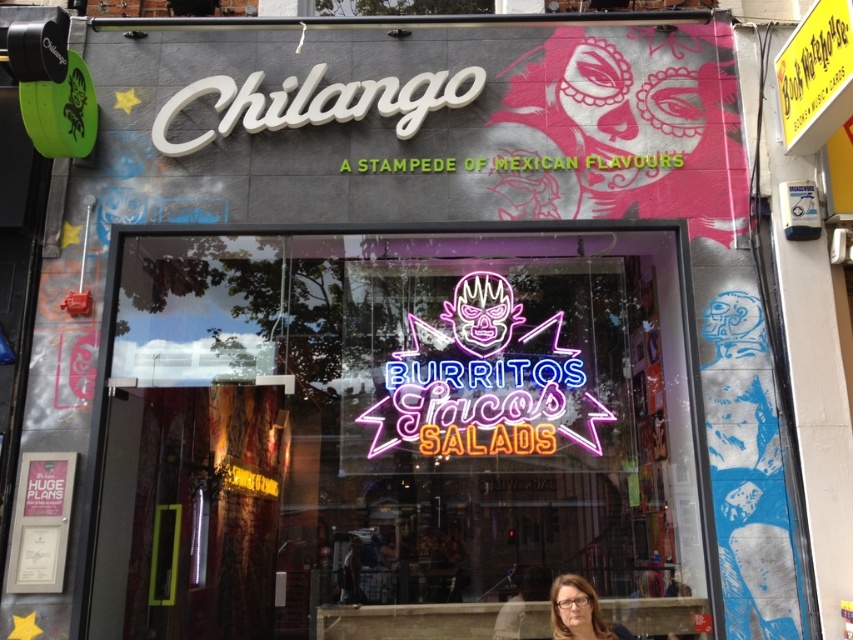
You are standing in front of the Chilango restaurant and notice two points on the neon sign. The first point is at coordinates point (x=485, y=528) and the second is at point (x=509, y=307). Which point is closer to you?

Point (x=485, y=528) is further to the viewer than point (x=509, y=307), so the second point is closer to you.

You are a customer looking at the restaurant window. You see the neon sign at center and the neontexturedsign at center. Which one is larger?

The neon sign at center is bigger than the neontexturedsign at center.